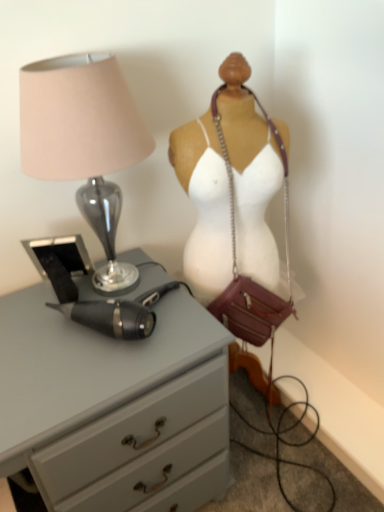
Question: Looking at their shapes, would you say leather/chain strap at center is wider or thinner than matte glass lamp at left?

Choices:
 (A) wide
 (B) thin

Answer: (B)

Question: Considering the positions of point (198, 265) and point (102, 75), is point (198, 265) closer or farther from the camera than point (102, 75)?

Choices:
 (A) farther
 (B) closer

Answer: (A)

Question: Considering the real-world distances, which object is farthest from the matte gray chest of drawers at left?

Choices:
 (A) matte glass lamp at left
 (B) leather/chain strap at center

Answer: (A)

Question: Which object is the closest to the leather/chain strap at center?

Choices:
 (A) matte glass lamp at left
 (B) matte gray chest of drawers at left

Answer: (A)